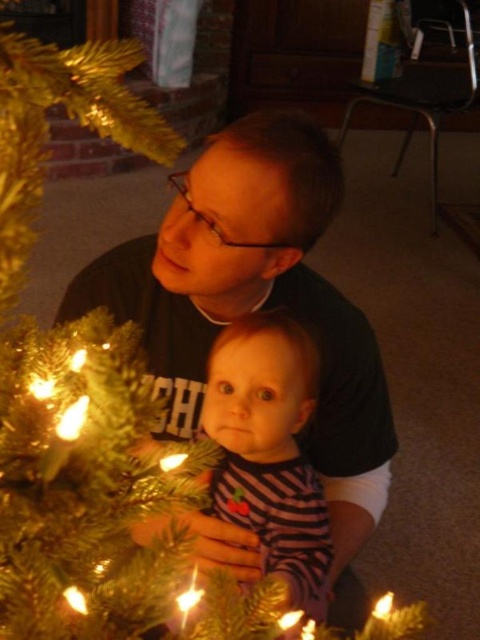
You are a photographer setting up a holiday photo shoot. You have two candles to place in the scene with the Christmas tree and the people. The translucent amber candle at lower right and the translucent glass candle at lower center. Which candle has a larger width?

The translucent amber candle at lower right has a larger width than the translucent glass candle at lower center.

You are a guest at a holiday party and see the shiny gold candle at lower center and the translucent amber candle at lower right on the table. Which candle is taller?

The translucent amber candle at lower right is taller than the shiny gold candle at lower center.

You are a guest at a holiday gathering and see the shiny gold candle at lower center and the translucent amber candle at lower right. Which candle is located to the left of the other?

The shiny gold candle at lower center is positioned on the left side of the translucent amber candle at lower right.